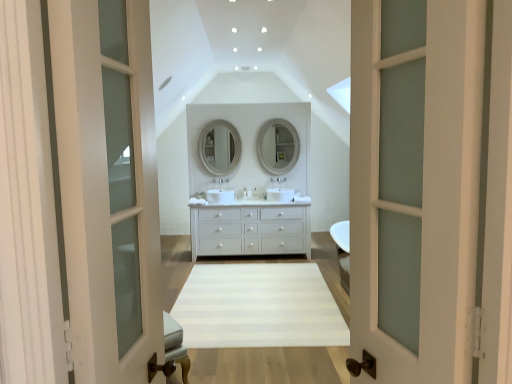
In order to face satin nickel faucet at center, the second faucet when ordered from right to left, should I rotate leftwards or rightwards?

To face it directly, rotate left by 5.457 degrees.

What do you see at coordinates (215, 181) in the screenshot?
I see `satin nickel faucet at center, the second faucet when ordered from right to left` at bounding box center [215, 181].

Describe the element at coordinates (250, 229) in the screenshot. This screenshot has width=512, height=384. I see `white matte chest of drawers at center` at that location.

What do you see at coordinates (278, 146) in the screenshot? I see `matte white mirror at center, which is the 2th mirror from left to right` at bounding box center [278, 146].

Where is `satin nickel faucet at center, the second faucet when ordered from right to left`? This screenshot has height=384, width=512. satin nickel faucet at center, the second faucet when ordered from right to left is located at coordinates tap(215, 181).

What's the angular difference between satin nickel faucet at center, acting as the first faucet starting from the left, and matte white mirror at center, which is the 2th mirror from left to right,'s facing directions?

0.308 degrees.

Is satin nickel faucet at center, acting as the first faucet starting from the left, not within matte white mirror at center, which is the 2th mirror from left to right?

Yes, satin nickel faucet at center, acting as the first faucet starting from the left, is outside of matte white mirror at center, which is the 2th mirror from left to right.

Can you confirm if satin nickel faucet at center, acting as the first faucet starting from the left, is taller than matte white mirror at center, which is the 2th mirror from left to right?

No, satin nickel faucet at center, acting as the first faucet starting from the left, is not taller than matte white mirror at center, which is the 2th mirror from left to right.

From the image's perspective, is satin nickel faucet at center, the second faucet when ordered from right to left, over matte white mirror at center, which is counted as the 1th mirror, starting from the right?

Incorrect, from the image's perspective, satin nickel faucet at center, the second faucet when ordered from right to left, is lower than matte white mirror at center, which is counted as the 1th mirror, starting from the right.

Considering the relative positions of satin nickel faucet at center, acting as the first faucet starting from the left, and white glossy sink at center in the image provided, is satin nickel faucet at center, acting as the first faucet starting from the left, to the left or to the right of white glossy sink at center?

In the image, satin nickel faucet at center, acting as the first faucet starting from the left, appears on the left side of white glossy sink at center.

Does satin nickel faucet at center, the second faucet when ordered from right to left, have a lesser height compared to white glossy sink at center?

Indeed, satin nickel faucet at center, the second faucet when ordered from right to left, has a lesser height compared to white glossy sink at center.

Where is `sink directly beneath the satin nickel faucet at center, the second faucet when ordered from right to left (from a real-world perspective)`? The width and height of the screenshot is (512, 384). sink directly beneath the satin nickel faucet at center, the second faucet when ordered from right to left (from a real-world perspective) is located at coordinates (279, 192).

Considering the relative sizes of white striped rug at center and satin nickel faucet at center, the second faucet when ordered from right to left, in the image provided, is white striped rug at center shorter than satin nickel faucet at center, the second faucet when ordered from right to left,?

Yes, white striped rug at center is shorter than satin nickel faucet at center, the second faucet when ordered from right to left.

Does white striped rug at center have a lesser width compared to satin nickel faucet at center, the second faucet when ordered from right to left?

No.

Is point (326, 293) closer to camera compared to point (215, 180)?

Yes, point (326, 293) is in front of point (215, 180).

Is the position of white glossy mirror at center, which appears as the second mirror when viewed from the right, less distant than that of matte silver faucet at center, marked as the 2th faucet in a left-to-right arrangement?

No, the depth of white glossy mirror at center, which appears as the second mirror when viewed from the right, is greater than that of matte silver faucet at center, marked as the 2th faucet in a left-to-right arrangement.

Between white glossy mirror at center, which appears as the second mirror when viewed from the right, and matte silver faucet at center, marked as the 2th faucet in a left-to-right arrangement, which one has less height?

Standing shorter between the two is matte silver faucet at center, marked as the 2th faucet in a left-to-right arrangement.

How much distance is there between white glossy mirror at center, which appears as the first mirror when viewed from the left, and matte silver faucet at center, marked as the 2th faucet in a left-to-right arrangement?

They are 19.77 inches apart.

Is white glossy mirror at center, which appears as the first mirror when viewed from the left, facing towards matte silver faucet at center, the 1th faucet in the right-to-left sequence?

No, white glossy mirror at center, which appears as the first mirror when viewed from the left, is not aimed at matte silver faucet at center, the 1th faucet in the right-to-left sequence.

Does point (278, 185) lie in front of point (280, 136)?

No, it is behind (280, 136).

Considering the relative sizes of white glossy sink at center and matte white mirror at center, which is counted as the 1th mirror, starting from the right, in the image provided, is white glossy sink at center bigger than matte white mirror at center, which is counted as the 1th mirror, starting from the right,?

Actually, white glossy sink at center might be smaller than matte white mirror at center, which is counted as the 1th mirror, starting from the right.

At what (x,y) coordinates should I click in order to perform the action: click on sink that is below the matte white mirror at center, which is the 2th mirror from left to right (from the image's perspective). Please return your answer as a coordinate pair (x, y). Looking at the image, I should click on (279, 192).

Considering the sizes of satin nickel faucet at center, the second faucet when ordered from right to left, and white frosted glass screen door at left in the image, is satin nickel faucet at center, the second faucet when ordered from right to left, wider or thinner than white frosted glass screen door at left?

Considering their sizes, satin nickel faucet at center, the second faucet when ordered from right to left, looks broader than white frosted glass screen door at left.

From the picture: Measure the distance from satin nickel faucet at center, acting as the first faucet starting from the left, to white frosted glass screen door at left.

satin nickel faucet at center, acting as the first faucet starting from the left, is 5.49 meters away from white frosted glass screen door at left.

Who is taller, satin nickel faucet at center, acting as the first faucet starting from the left, or white frosted glass screen door at left?

white frosted glass screen door at left is taller.

Is white glossy mirror at center, which appears as the first mirror when viewed from the left, to the right of white glossy sink at center from the viewer's perspective?

Incorrect, white glossy mirror at center, which appears as the first mirror when viewed from the left, is not on the right side of white glossy sink at center.

Considering the relative sizes of white glossy mirror at center, which appears as the first mirror when viewed from the left, and white glossy sink at center in the image provided, is white glossy mirror at center, which appears as the first mirror when viewed from the left, shorter than white glossy sink at center?

In fact, white glossy mirror at center, which appears as the first mirror when viewed from the left, may be taller than white glossy sink at center.

In terms of width, does white glossy mirror at center, which appears as the second mirror when viewed from the right, look wider or thinner when compared to white glossy sink at center?

Clearly, white glossy mirror at center, which appears as the second mirror when viewed from the right, has less width compared to white glossy sink at center.

Between white glossy mirror at center, which appears as the first mirror when viewed from the left, and white glossy sink at center, which one has smaller size?

white glossy sink at center is smaller.

Starting from the satin nickel faucet at center, acting as the first faucet starting from the left, which mirror is the 2nd one to the right? Please provide its 2D coordinates.

[(278, 146)]

Where is `the 2nd faucet above the white glossy sink at center (from a real-world perspective)`? the 2nd faucet above the white glossy sink at center (from a real-world perspective) is located at coordinates (215, 181).

Looking at the image, which one is located further to white frosted glass door at center, white matte chest of drawers at center or matte silver faucet at center, the 1th faucet in the right-to-left sequence?

matte silver faucet at center, the 1th faucet in the right-to-left sequence, lies further to white frosted glass door at center than the other object.

Based on their spatial positions, is white frosted glass door at center or white glossy mirror at center, which appears as the second mirror when viewed from the right, further from white matte chest of drawers at center?

white frosted glass door at center is positioned further to the anchor white matte chest of drawers at center.

Based on their spatial positions, is white striped rug at center or white matte chest of drawers at center closer to white frosted glass screen door at left?

Among the two, white striped rug at center is located nearer to white frosted glass screen door at left.

Based on their spatial positions, is satin nickel faucet at center, the second faucet when ordered from right to left, or white frosted glass screen door at left further from matte white mirror at center, which is the 2th mirror from left to right?

white frosted glass screen door at left is positioned further to the anchor matte white mirror at center, which is the 2th mirror from left to right.

Considering their positions, is white matte chest of drawers at center positioned closer to matte silver faucet at center, the 1th faucet in the right-to-left sequence, than white striped rug at center?

The object closer to matte silver faucet at center, the 1th faucet in the right-to-left sequence, is white matte chest of drawers at center.

Considering their positions, is white striped rug at center positioned closer to white matte chest of drawers at center than white glossy sink at center?

Among the two, white glossy sink at center is located nearer to white matte chest of drawers at center.

Considering their positions, is white matte chest of drawers at center positioned closer to matte white mirror at center, which is the 2th mirror from left to right, than matte silver faucet at center, marked as the 2th faucet in a left-to-right arrangement?

matte silver faucet at center, marked as the 2th faucet in a left-to-right arrangement, lies closer to matte white mirror at center, which is the 2th mirror from left to right, than the other object.

Based on their spatial positions, is white frosted glass door at center or white matte chest of drawers at center further from white striped rug at center?

The object further to white striped rug at center is white frosted glass door at center.

What are the coordinates of `faucet between white glossy mirror at center, which appears as the first mirror when viewed from the left, and matte silver faucet at center, the 1th faucet in the right-to-left sequence, in the up-down direction` in the screenshot? It's located at (215, 181).

The image size is (512, 384). Find the location of `sink between white striped rug at center and matte white mirror at center, which is counted as the 1th mirror, starting from the right, from front to back`. sink between white striped rug at center and matte white mirror at center, which is counted as the 1th mirror, starting from the right, from front to back is located at coordinates (279, 192).

Where is `chest of drawers between white striped rug at center and satin nickel faucet at center, the second faucet when ordered from right to left, along the z-axis`? chest of drawers between white striped rug at center and satin nickel faucet at center, the second faucet when ordered from right to left, along the z-axis is located at coordinates (250, 229).

Identify the location of faucet located between white glossy mirror at center, which appears as the first mirror when viewed from the left, and white glossy sink at center in the left-right direction. This screenshot has height=384, width=512. (221, 181).